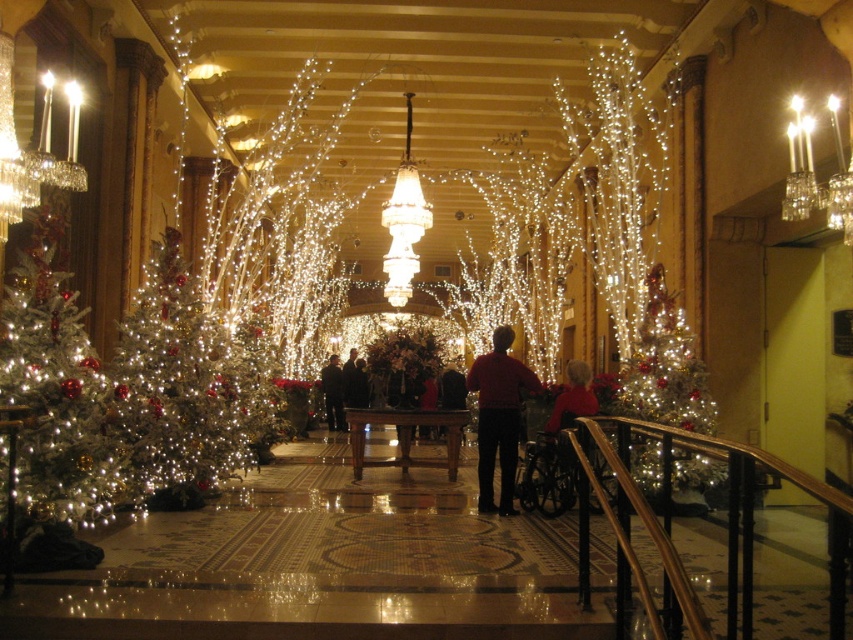
Is clear glass candlesticks at upper right further to camera compared to red velvet sweater at center?

No.

Is clear glass candlesticks at upper right taller than red velvet sweater at center?

Yes, clear glass candlesticks at upper right is taller than red velvet sweater at center.

Who is more forward, (845, 237) or (567, 390)?

Positioned in front is point (845, 237).

Where is `clear glass candlesticks at upper right`? Image resolution: width=853 pixels, height=640 pixels. clear glass candlesticks at upper right is located at coordinates (814, 172).

Does point (654, 420) lie behind point (567, 392)?

No, (654, 420) is closer to viewer.

Measure the distance from shiny silver christmas tree at right to red velvet sweater at center.

1.13 meters

Where is `shiny silver christmas tree at right`? shiny silver christmas tree at right is located at coordinates (664, 365).

This screenshot has height=640, width=853. In order to click on shiny silver christmas tree at right in this screenshot , I will do `click(664, 365)`.

Measure the distance from red matte shirt at center to dark suit at center.

red matte shirt at center is 57.36 feet away from dark suit at center.

Who is lower down, red matte shirt at center or dark suit at center?

Positioned lower is dark suit at center.

The height and width of the screenshot is (640, 853). In order to click on red matte shirt at center in this screenshot , I will do `click(498, 417)`.

Image resolution: width=853 pixels, height=640 pixels. I want to click on red matte shirt at center, so click(498, 417).